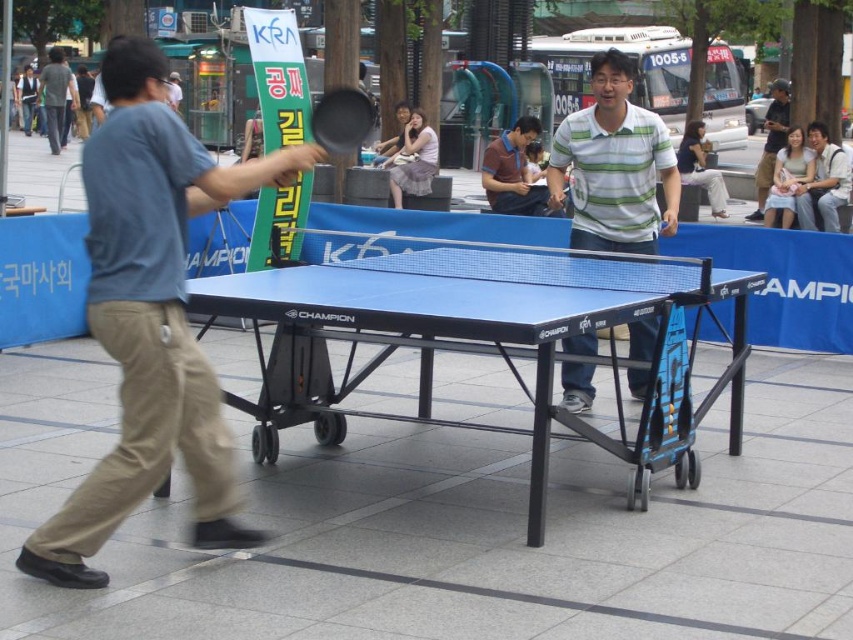
Between point (334, 99) and point (712, 216), which one is positioned behind?

The point (712, 216) is more distant.

From the picture: Who is positioned more to the left, black rubber paddle at center or dark blue shirt at center?

Positioned to the left is black rubber paddle at center.

Locate an element on the screen. The height and width of the screenshot is (640, 853). black rubber paddle at center is located at coordinates (341, 120).

Locate an element on the screen. light brown leather jacket at upper right is located at coordinates (822, 182).

Who is more distant from viewer, [807,182] or [415,125]?

Point [415,125]

Find the location of a particular element. The height and width of the screenshot is (640, 853). light brown leather jacket at upper right is located at coordinates click(822, 182).

Is striped cotton polo shirt at center above dark blue jeans at center?

Incorrect, striped cotton polo shirt at center is not positioned above dark blue jeans at center.

In the scene shown: Does striped cotton polo shirt at center have a greater height compared to dark blue jeans at center?

Incorrect, striped cotton polo shirt at center's height is not larger of dark blue jeans at center's.

Where is `striped cotton polo shirt at center`? This screenshot has height=640, width=853. striped cotton polo shirt at center is located at coordinates (614, 164).